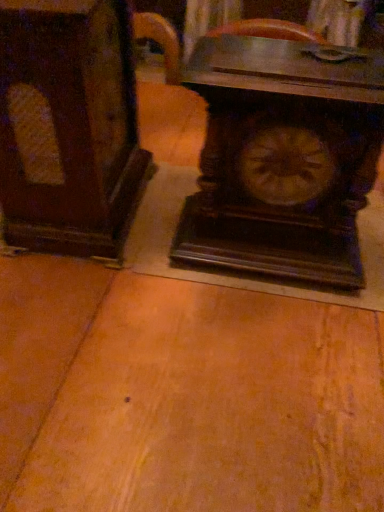
What is the approximate width of wooden carved clock at center?

wooden carved clock at center is 6.64 inches in width.

What do you see at coordinates (68, 126) in the screenshot?
I see `dark wood cabinet at left` at bounding box center [68, 126].

Find the location of a particular element. The image size is (384, 512). wooden carved clock at center is located at coordinates (282, 159).

Between dark wood table at center and dark wood cabinet at left, which one has smaller width?

Thinner between the two is dark wood cabinet at left.

How many degrees apart are the facing directions of dark wood table at center and dark wood cabinet at left?

The facing directions of dark wood table at center and dark wood cabinet at left are 172 degrees apart.

Considering the sizes of dark wood table at center and dark wood cabinet at left in the image, is dark wood table at center bigger or smaller than dark wood cabinet at left?

dark wood table at center is bigger than dark wood cabinet at left.

Could you tell me if dark wood table at center is facing dark wood cabinet at left?

No, dark wood table at center is not aimed at dark wood cabinet at left.

Would you consider wooden carved clock at center to be distant from dark wood cabinet at left?

That's not correct — wooden carved clock at center is a little close to dark wood cabinet at left.

Is wooden carved clock at center further to the viewer compared to dark wood cabinet at left?

Yes, wooden carved clock at center is further from the viewer.

What's the angular difference between wooden carved clock at center and dark wood cabinet at left's facing directions?

1.76 degrees separate the facing orientations of wooden carved clock at center and dark wood cabinet at left.

Is wooden carved clock at center positioned beyond the bounds of dark wood cabinet at left?

Yes, wooden carved clock at center is located beyond the bounds of dark wood cabinet at left.

Considering the positions of point (142, 411) and point (223, 42), is point (142, 411) closer or farther from the camera than point (223, 42)?

Point (142, 411) is closer to the camera than point (223, 42).

Locate an element on the screen. wall clock above the dark wood table at center (from the image's perspective) is located at coordinates (282, 159).

In terms of width, does dark wood table at center look wider or thinner when compared to wooden carved clock at center?

Clearly, dark wood table at center has more width compared to wooden carved clock at center.

In terms of size, does dark wood table at center appear bigger or smaller than wooden carved clock at center?

In the image, dark wood table at center appears to be larger than wooden carved clock at center.

Considering the sizes of dark wood cabinet at left and dark wood table at center in the image, is dark wood cabinet at left bigger or smaller than dark wood table at center?

Clearly, dark wood cabinet at left is smaller in size than dark wood table at center.

Is dark wood table at center surrounded by dark wood cabinet at left?

Actually, dark wood table at center is outside dark wood cabinet at left.

Is dark wood cabinet at left wider than dark wood table at center?

No, dark wood cabinet at left is not wider than dark wood table at center.

From the image's perspective, which one is positioned lower, wooden carved clock at center or dark wood table at center?

dark wood table at center, from the image's perspective.

In terms of size, does wooden carved clock at center appear bigger or smaller than dark wood table at center?

wooden carved clock at center is smaller than dark wood table at center.

Is wooden carved clock at center facing towards dark wood table at center?

Yes, wooden carved clock at center faces towards dark wood table at center.

The height and width of the screenshot is (512, 384). What are the coordinates of `table that is in front of the wooden carved clock at center` in the screenshot? It's located at (182, 396).

Is dark wood cabinet at left not within wooden carved clock at center?

Yes, dark wood cabinet at left is outside of wooden carved clock at center.

Does dark wood cabinet at left touch wooden carved clock at center?

No, dark wood cabinet at left is not touching wooden carved clock at center.

From a real-world perspective, which object stands above the other?

dark wood cabinet at left, from a real-world perspective.

Locate an element on the screen. The height and width of the screenshot is (512, 384). table in front of the dark wood cabinet at left is located at coordinates (182, 396).

You are a GUI agent. You are given a task and a screenshot of the screen. Output one action in this format:
    pyautogui.click(x=<x>, y=<y>)
    Task: Click on the furniture that appears above the wooden carved clock at center (from a real-world perspective)
    
    Given the screenshot: What is the action you would take?
    pyautogui.click(x=68, y=126)

When comparing their distances from dark wood cabinet at left, does dark wood table at center or wooden carved clock at center seem closer?

The object closer to dark wood cabinet at left is wooden carved clock at center.

Which object lies further to the anchor point dark wood table at center, wooden carved clock at center or dark wood cabinet at left?

Among the two, dark wood cabinet at left is located further to dark wood table at center.

When comparing their distances from wooden carved clock at center, does dark wood cabinet at left or dark wood table at center seem closer?

dark wood cabinet at left.

In the scene shown: From the image, which object appears to be farther from dark wood cabinet at left, wooden carved clock at center or dark wood table at center?

The object further to dark wood cabinet at left is dark wood table at center.

Looking at this image, which object lies nearer to the anchor point dark wood table at center, dark wood cabinet at left or wooden carved clock at center?

wooden carved clock at center is positioned closer to the anchor dark wood table at center.

When comparing their distances from wooden carved clock at center, does dark wood table at center or dark wood cabinet at left seem closer?

dark wood cabinet at left.

Where is `wall clock between dark wood cabinet at left and dark wood table at center vertically`? wall clock between dark wood cabinet at left and dark wood table at center vertically is located at coordinates (282, 159).